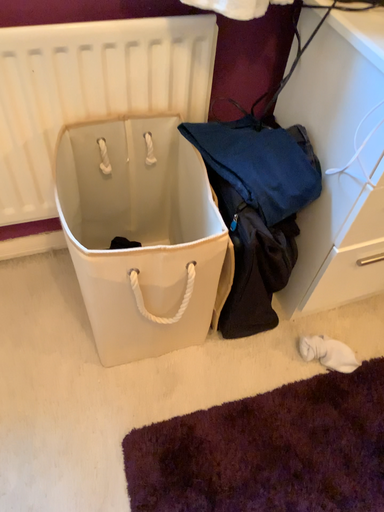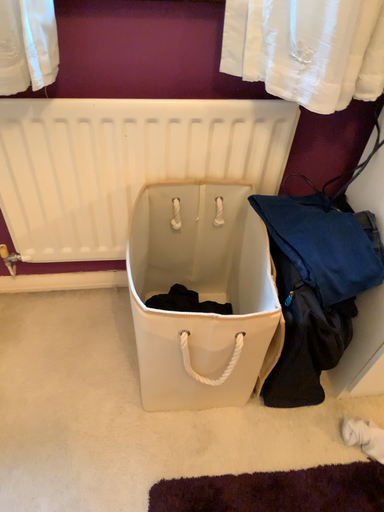
Question: Which way did the camera rotate in the video?

Choices:
 (A) rotated left
 (B) rotated right

Answer: (A)